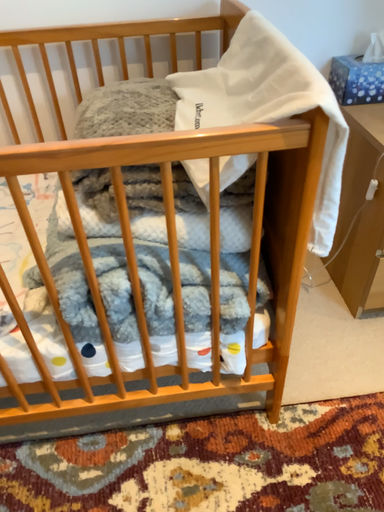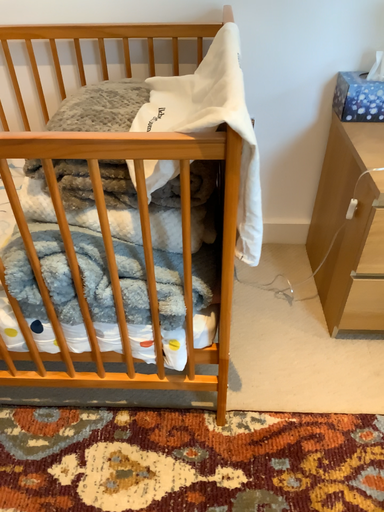
Question: How did the camera likely rotate when shooting the video?

Choices:
 (A) rotated left
 (B) rotated right

Answer: (A)